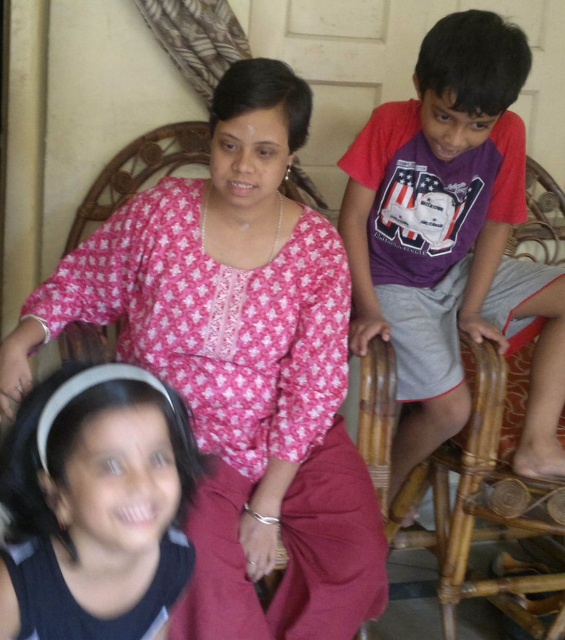
Can you confirm if pink printed blouse at center is taller than purple cotton shirt at right?

No.

Who is more distant from viewer, (258, 307) or (427, 403)?

The point (427, 403) is behind.

Is point (175, 221) behind point (471, 44)?

Yes, it is behind point (471, 44).

Where is `pink printed blouse at center`? Image resolution: width=565 pixels, height=640 pixels. pink printed blouse at center is located at coordinates [x=240, y=365].

Does pink printed blouse at center have a greater height compared to black matte hairband at lower left?

Correct, pink printed blouse at center is much taller as black matte hairband at lower left.

Which is in front, point (142, 305) or point (180, 579)?

Point (180, 579)

Locate an element on the screen. This screenshot has height=640, width=565. pink printed blouse at center is located at coordinates (240, 365).

Who is shorter, purple cotton shirt at right or black matte hairband at lower left?

Standing shorter between the two is black matte hairband at lower left.

Can you confirm if purple cotton shirt at right is positioned to the right of black matte hairband at lower left?

Correct, you'll find purple cotton shirt at right to the right of black matte hairband at lower left.

Who is more distant from viewer, (455, 385) or (125, 426)?

Point (455, 385)

Locate an element on the screen. purple cotton shirt at right is located at coordinates (452, 240).